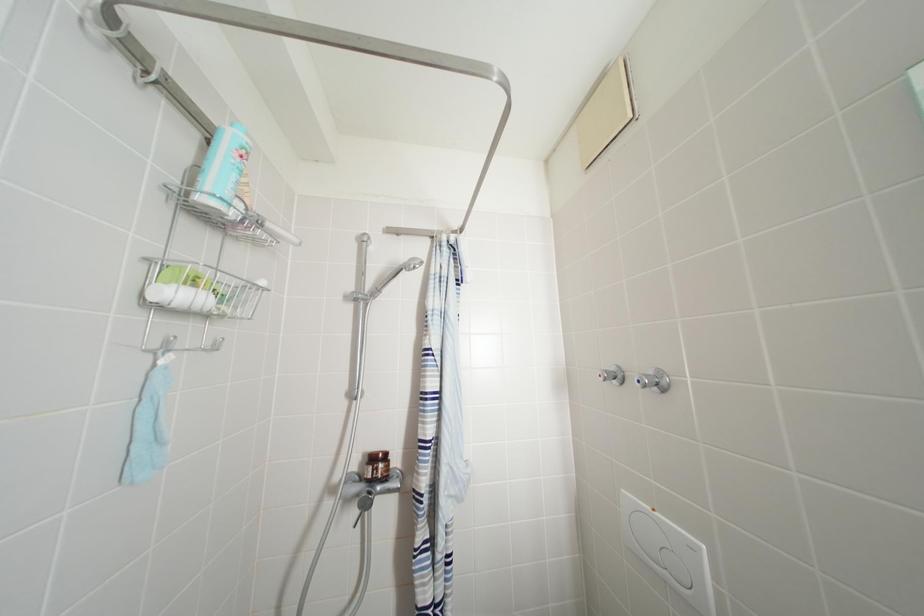
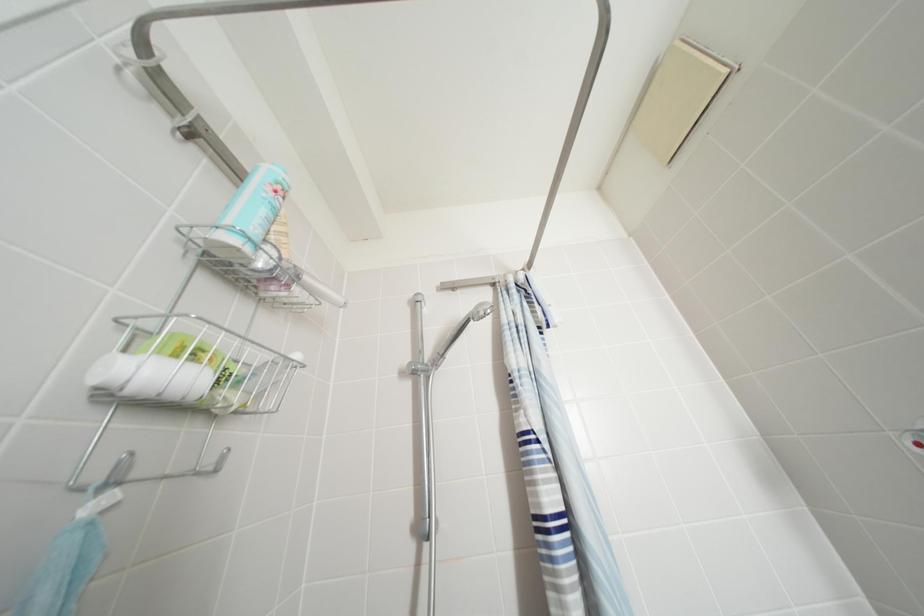
Question: The images are taken continuously from a first-person perspective. In which direction is your viewpoint rotating?

Choices:
 (A) Left
 (B) Right
 (C) Up
 (D) Down

Answer: (C)